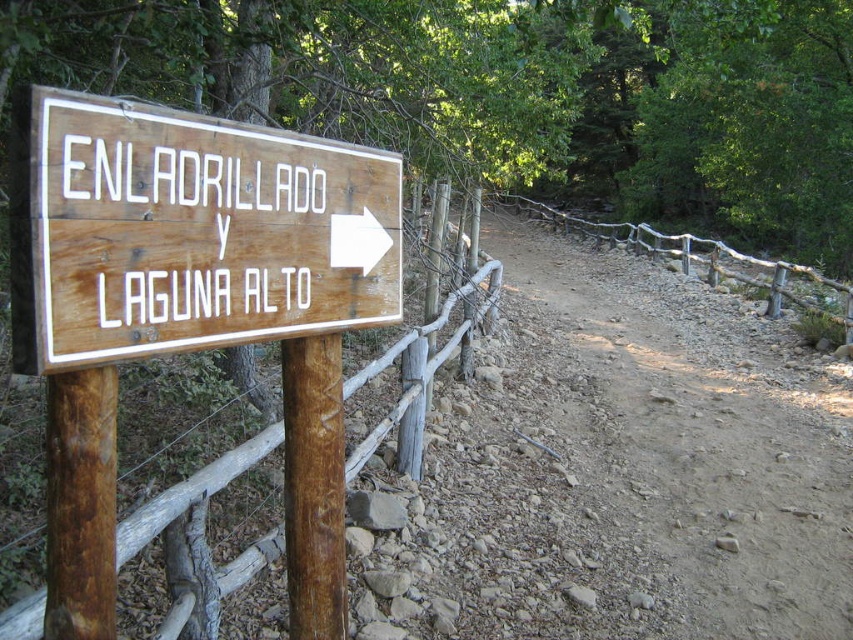
Which is above, wooden fence at left or brown wood post at left?

wooden fence at left is higher up.

Does wooden fence at left have a greater width compared to brown wood post at left?

Yes, wooden fence at left is wider than brown wood post at left.

This screenshot has width=853, height=640. Find the location of `wooden fence at left`. wooden fence at left is located at coordinates (430, 332).

At what (x,y) coordinates should I click in order to perform the action: click on wooden fence at left. Please return your answer as a coordinate pair (x, y). This screenshot has width=853, height=640. Looking at the image, I should click on (430, 332).

Does wooden sign at left appear under wooden fence at left?

Yes.

Is wooden sign at left taller than wooden fence at left?

Incorrect, wooden sign at left's height is not larger of wooden fence at left's.

What do you see at coordinates (194, 234) in the screenshot?
I see `wooden sign at left` at bounding box center [194, 234].

The image size is (853, 640). I want to click on wooden sign at left, so tap(194, 234).

Does point (194, 147) lie behind point (300, 385)?

No, it is in front of (300, 385).

Between wooden sign at left and brown wood post at left, which one has more height?

brown wood post at left

Where is `wooden sign at left`? wooden sign at left is located at coordinates click(x=194, y=234).

This screenshot has width=853, height=640. I want to click on wooden sign at left, so click(194, 234).